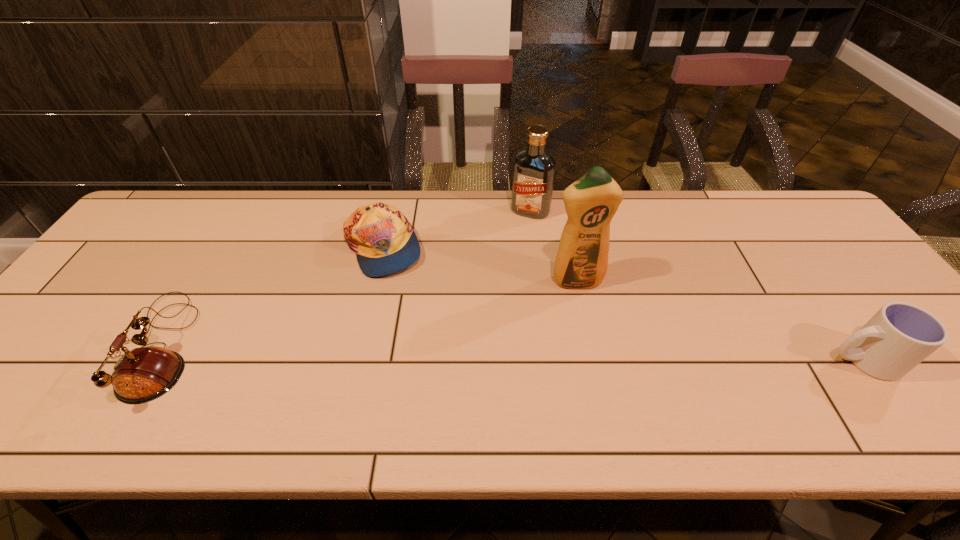
Identify the location of object that can be found as the fourth closest to the second tallest object. The width and height of the screenshot is (960, 540). (141, 375).

The image size is (960, 540). Identify the location of free location that satisfies the following two spatial constraints: 1. on the front side of the cap; 2. with the handle on the side of the cup. (357, 360).

Image resolution: width=960 pixels, height=540 pixels. I want to click on vacant area that satisfies the following two spatial constraints: 1. on the front side of the cap; 2. with the handle on the side of the rightmost object, so click(357, 360).

You are a GUI agent. You are given a task and a screenshot of the screen. Output one action in this format:
    pyautogui.click(x=<x>, y=<y>)
    Task: Click on the free point that satisfies the following two spatial constraints: 1. on the front side of the second object from left to right; 2. with the handle on the side of the rightmost object
    This screenshot has width=960, height=540.
    Given the screenshot: What is the action you would take?
    pyautogui.click(x=357, y=360)